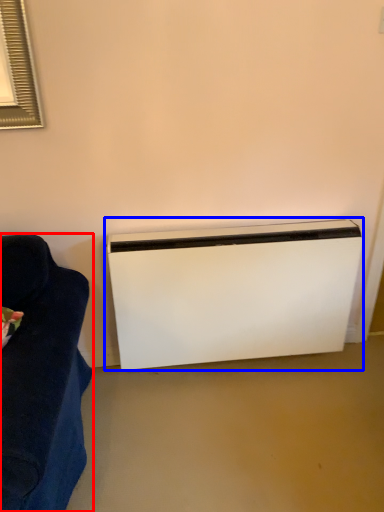
Question: Which object appears farthest to the camera in this image, furniture (highlighted by a red box) or home appliance (highlighted by a blue box)?

Choices:
 (A) furniture
 (B) home appliance

Answer: (B)